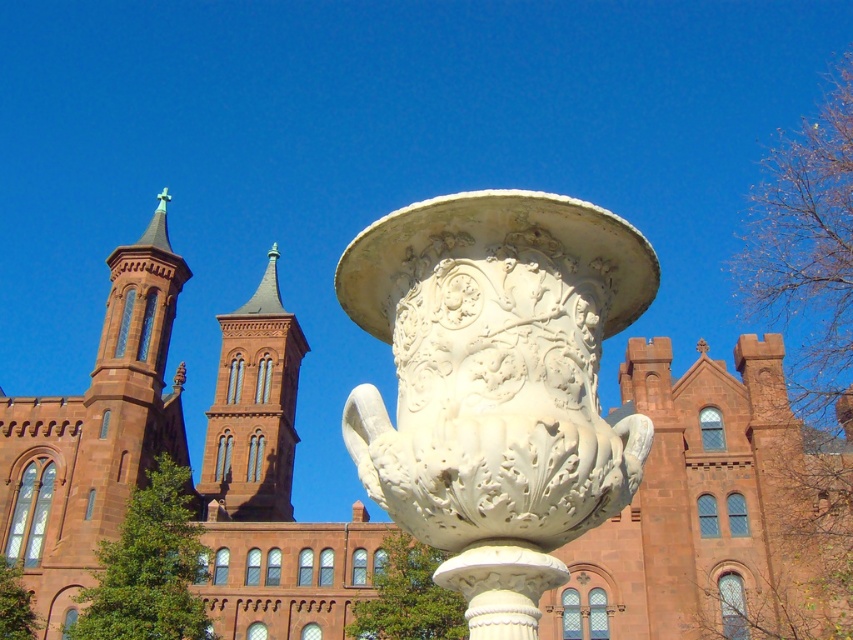
Question: Which of these objects is positioned closest to the red brick tower at center?

Choices:
 (A) white stone vase at center
 (B) matte stone church at center

Answer: (B)

Question: Can you confirm if white stone vase at center is positioned to the right of red brick tower at center?

Choices:
 (A) yes
 (B) no

Answer: (A)

Question: Based on their relative distances, which object is farther from the matte stone church at center?

Choices:
 (A) white stone vase at center
 (B) red brick tower at center

Answer: (A)

Question: Does white stone vase at center appear under red brick tower at center?

Choices:
 (A) no
 (B) yes

Answer: (A)

Question: Where is matte stone church at center located in relation to red brick tower at center in the image?

Choices:
 (A) below
 (B) above

Answer: (B)

Question: Which object is closer to the camera taking this photo?

Choices:
 (A) matte stone church at center
 (B) red brick tower at center

Answer: (A)